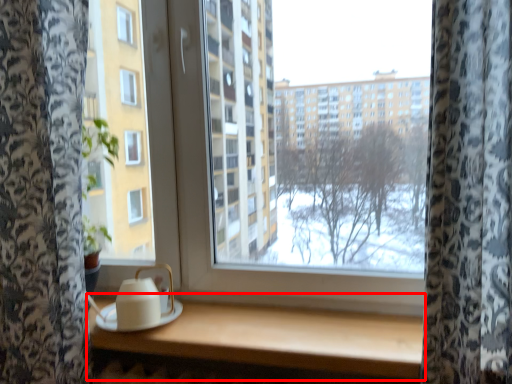
Question: In this image, where is table (annotated by the red box) located relative to tea set?

Choices:
 (A) right
 (B) left

Answer: (A)